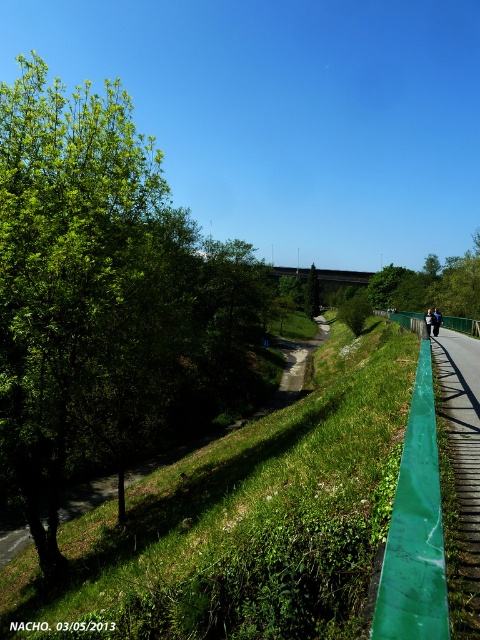
Which is above, green leafy tree at left or green leafy tree at center?

green leafy tree at left

Who is positioned more to the left, green leafy tree at left or green leafy tree at center?

Positioned to the left is green leafy tree at left.

Is point (20, 113) closer to camera compared to point (311, 308)?

Yes, point (20, 113) is closer to viewer.

Image resolution: width=480 pixels, height=640 pixels. I want to click on green leafy tree at left, so click(105, 300).

Can you confirm if green leafy tree at left is shorter than dark blue jacket at center?

No.

Is green leafy tree at left positioned at the back of dark blue jacket at center?

No.

Is point (48, 470) farther from viewer compared to point (430, 332)?

No, (48, 470) is closer to viewer.

At what (x,y) coordinates should I click in order to perform the action: click on green leafy tree at left. Please return your answer as a coordinate pair (x, y). Looking at the image, I should click on pyautogui.click(x=105, y=300).

Which is more to the left, green leafy tree at center or dark blue jacket at center?

green leafy tree at center

Between green leafy tree at center and dark blue jacket at center, which one is positioned lower?

Positioned lower is dark blue jacket at center.

Which is behind, point (315, 276) or point (427, 316)?

The point (315, 276) is more distant.

The height and width of the screenshot is (640, 480). What are the coordinates of `green leafy tree at center` in the screenshot? It's located at (312, 292).